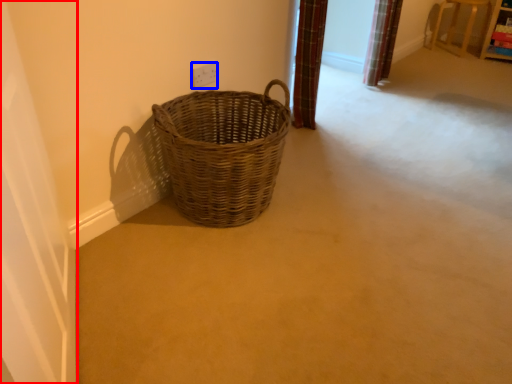
Question: Which of the following is the closest to the observer, screen door (highlighted by a red box) or electric outlet (highlighted by a blue box)?

Choices:
 (A) screen door
 (B) electric outlet

Answer: (A)